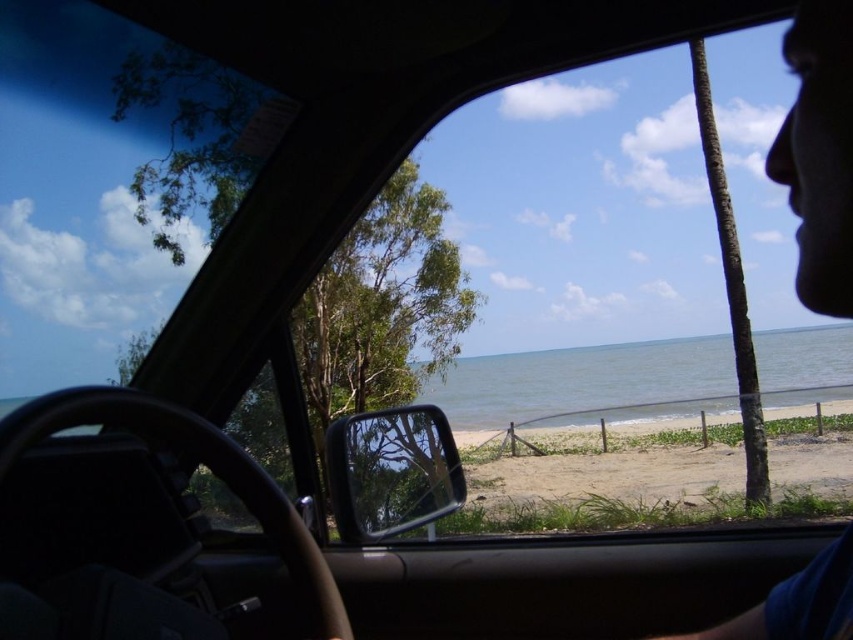
You are sitting in the car and looking out through the windshield. There is a point marked at coordinates (529,476). Based on the scene, where is this point located?

The point (529,476) is on the sandy beach at lower center.

In the scene shown: You are a photographer trying to capture the sandy beach at lower center and the blue fabric face at upper right in a single frame. Based on their widths, which object should you focus on to ensure both fit in the photo?

The sandy beach at lower center is wider than the blue fabric face at upper right, so focusing on the sandy beach at lower center will help ensure both fit in the photo as it occupies more space.

You are a passenger in the car and want to know which object in the scene takes up more space in your view. Which one is larger between the sandy beach at lower center and the blue fabric face at upper right?

The sandy beach at lower center is bigger than the blue fabric face at upper right, so it takes up more space in the view.